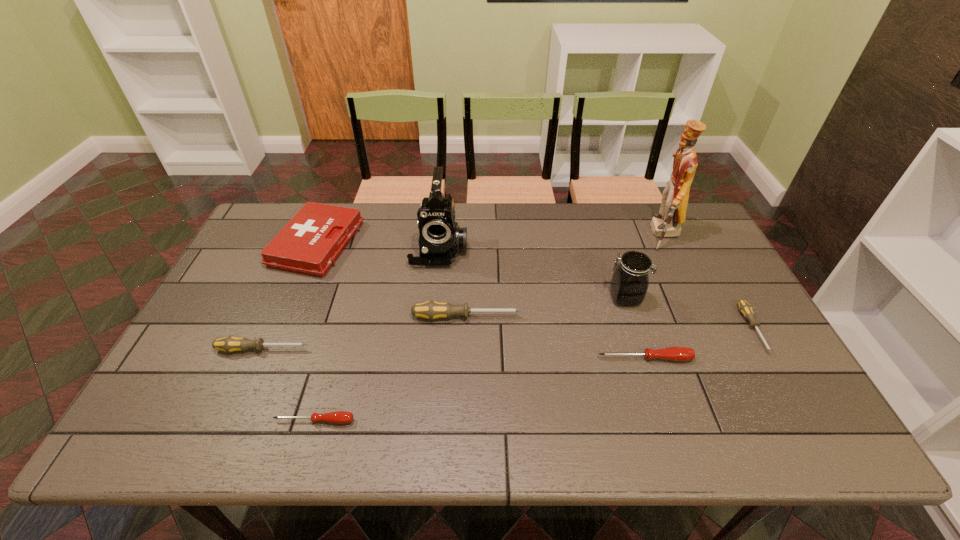
The image size is (960, 540). In order to click on nutcracker in this screenshot , I will do `click(667, 223)`.

Image resolution: width=960 pixels, height=540 pixels. Find the location of `the tallest object`. the tallest object is located at coordinates (667, 223).

Find the location of a particular element. This screenshot has height=540, width=960. camcorder is located at coordinates (440, 238).

This screenshot has width=960, height=540. In order to click on the seventh shortest object in this screenshot , I will do `click(630, 280)`.

Image resolution: width=960 pixels, height=540 pixels. What are the coordinates of `the first-aid kit` in the screenshot? It's located at (310, 243).

At what (x,y) coordinates should I click in order to perform the action: click on the biggest gray screwdriver. Please return your answer as a coordinate pair (x, y). Looking at the image, I should click on (431, 310).

The height and width of the screenshot is (540, 960). Identify the location of the second gray screwdriver from left to right. (431, 310).

Identify the location of the second biggest gray screwdriver. This screenshot has height=540, width=960. (230, 344).

Find the location of a particular element. the right red screwdriver is located at coordinates (672, 353).

Identify the location of the farther red screwdriver. (672, 353).